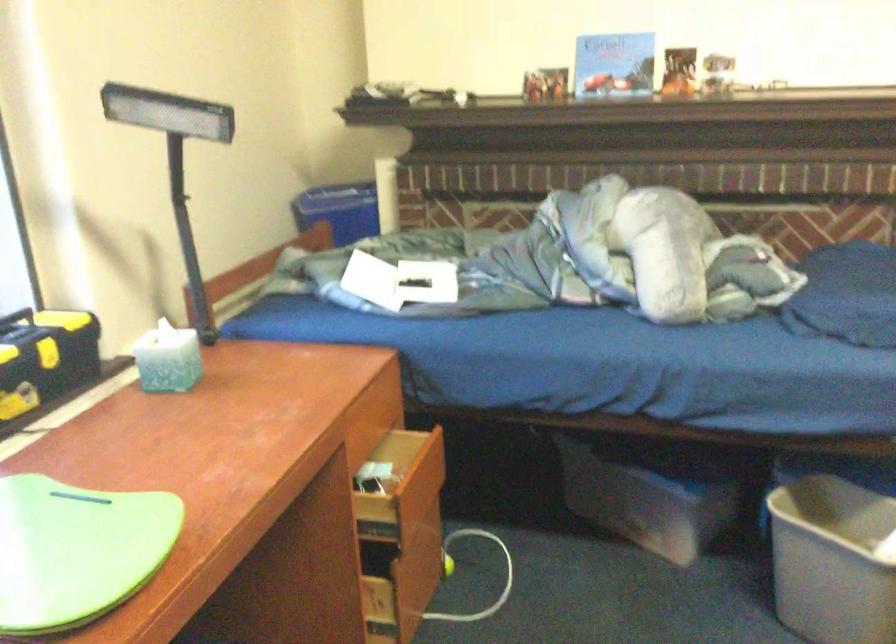
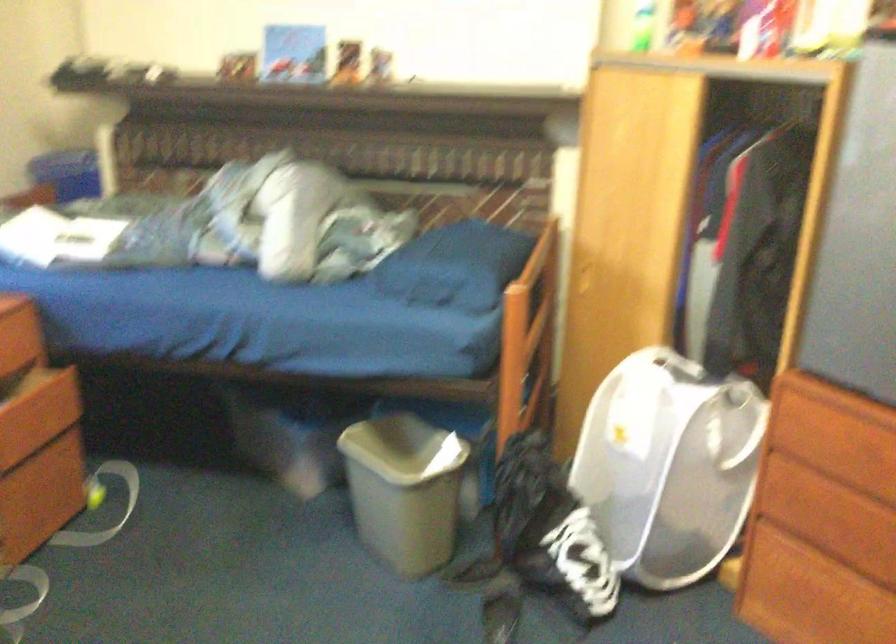
The images are taken continuously from a first-person perspective. In which direction are you moving?

The cameraman walked toward right, backward.